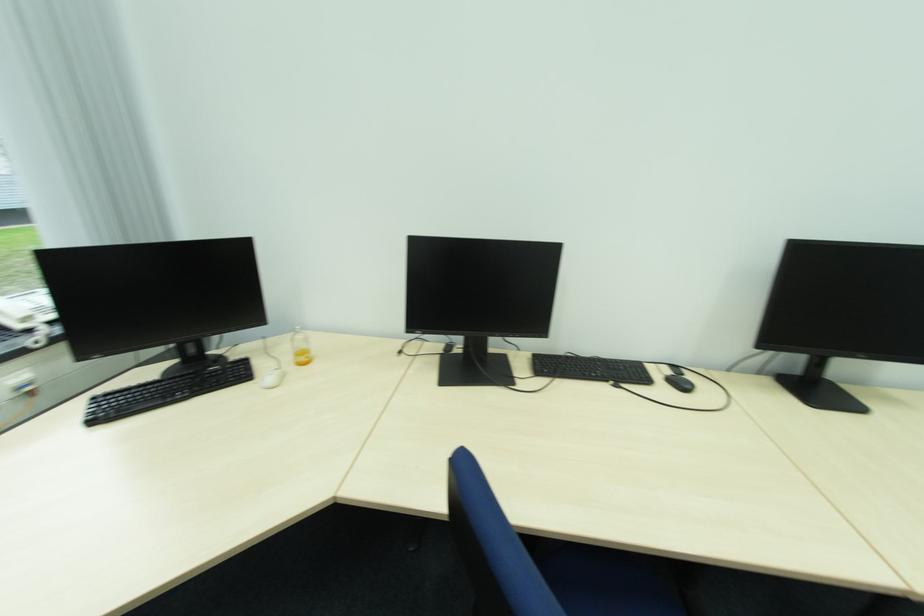
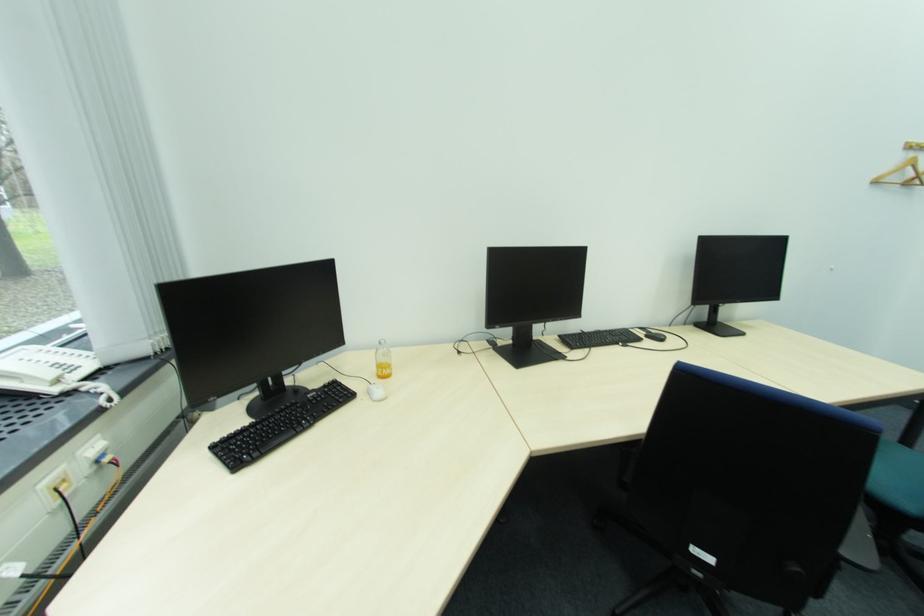
Question: The camera is either moving clockwise (left) or counter-clockwise (right) around the object. The first image is from the beginning of the video and the second image is from the end. Is the camera moving left or right when shooting the video?

Choices:
 (A) Left
 (B) Right

Answer: (A)